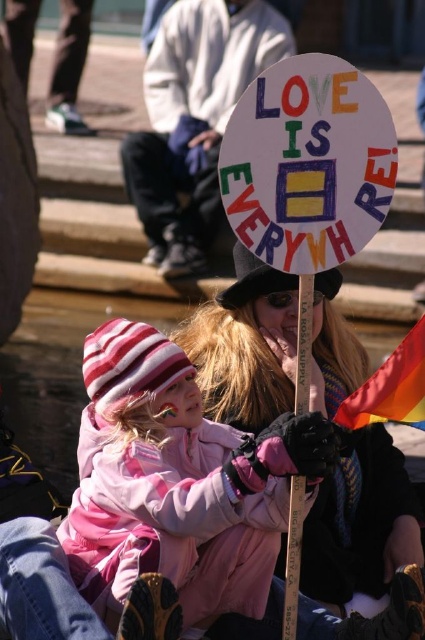
Question: Is pink fleece jacket at center smaller than matte black hat at center?

Choices:
 (A) yes
 (B) no

Answer: (A)

Question: Does matte black hat at center appear on the left side of hand-drawn paper sign at center?

Choices:
 (A) no
 (B) yes

Answer: (B)

Question: Which of the following is the farthest from the observer?

Choices:
 (A) 252,522
 (B) 309,284

Answer: (A)

Question: Among these points, which one is farthest from the camera?

Choices:
 (A) (243, 154)
 (B) (291, 477)
 (C) (112, 435)
 (D) (350, 456)

Answer: (D)

Question: Is pink fleece jacket at center closer to camera compared to wooden signpost at center?

Choices:
 (A) no
 (B) yes

Answer: (B)

Question: Which object is positioned closest to the hand-drawn paper sign at center?

Choices:
 (A) matte black hat at center
 (B) wooden signpost at center

Answer: (B)